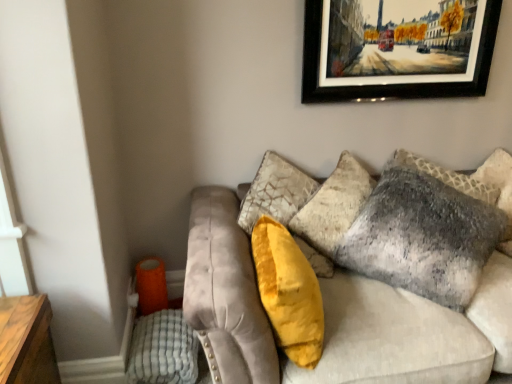
Describe the element at coordinates (397, 49) in the screenshot. Image resolution: width=512 pixels, height=384 pixels. I see `wooden-framed painting at upper center` at that location.

Find the location of a particular element. The width and height of the screenshot is (512, 384). velvet gray couch at center is located at coordinates (412, 332).

In terms of height, does textured gray pillow at upper right, which is the 3th pillow in left-to-right order, look taller or shorter compared to velvet gray couch at center?

Clearly, textured gray pillow at upper right, which is the 3th pillow in left-to-right order, is taller compared to velvet gray couch at center.

Considering the sizes of textured gray pillow at upper right, the first pillow positioned from the right, and velvet gray couch at center in the image, is textured gray pillow at upper right, the first pillow positioned from the right, bigger or smaller than velvet gray couch at center?

In the image, textured gray pillow at upper right, the first pillow positioned from the right, appears to be smaller than velvet gray couch at center.

Is textured gray pillow at upper right, which is the 3th pillow in left-to-right order, situated inside velvet gray couch at center or outside?

textured gray pillow at upper right, which is the 3th pillow in left-to-right order, is contained in velvet gray couch at center.

Is point (509, 155) farther from camera compared to point (297, 197)?

Yes.

Between textured gray pillow at upper right, marked as the second pillow in a right-to-left arrangement, and yellow fabric pillow at center, placed as the 1th pillow when sorted from left to right, which one has less height?

Standing shorter between the two is yellow fabric pillow at center, placed as the 1th pillow when sorted from left to right.

Measure the distance between textured gray pillow at upper right, marked as the second pillow in a right-to-left arrangement, and yellow fabric pillow at center, placed as the 1th pillow when sorted from left to right.

textured gray pillow at upper right, marked as the second pillow in a right-to-left arrangement, and yellow fabric pillow at center, placed as the 1th pillow when sorted from left to right, are 22.61 inches apart.

Would you say textured gray pillow at upper right, marked as the second pillow in a right-to-left arrangement, is a long distance from yellow fabric pillow at center, which is the third pillow in right-to-left order?

That's not correct — textured gray pillow at upper right, marked as the second pillow in a right-to-left arrangement, is a little close to yellow fabric pillow at center, which is the third pillow in right-to-left order.

From the image's perspective, is textured gray pillow at upper right, which ranks as the second pillow in left-to-right order, located beneath yellow fabric pillow at center, which is the third pillow in right-to-left order?

Actually, textured gray pillow at upper right, which ranks as the second pillow in left-to-right order, appears above yellow fabric pillow at center, which is the third pillow in right-to-left order, in the image.

How different are the orientations of velvet gray couch at center and yellow fabric pillow at center, placed as the 1th pillow when sorted from left to right, in degrees?

They differ by 85.3 degrees in their facing directions.

From the image's perspective, is velvet gray couch at center located above or below yellow fabric pillow at center, placed as the 1th pillow when sorted from left to right?

Based on their image positions, velvet gray couch at center is located beneath yellow fabric pillow at center, placed as the 1th pillow when sorted from left to right.

The width and height of the screenshot is (512, 384). Find the location of `studio couch located below the yellow fabric pillow at center, placed as the 1th pillow when sorted from left to right (from the image's perspective)`. studio couch located below the yellow fabric pillow at center, placed as the 1th pillow when sorted from left to right (from the image's perspective) is located at coordinates (412, 332).

Would you say velvet gray couch at center is inside or outside yellow fabric pillow at center, placed as the 1th pillow when sorted from left to right?

velvet gray couch at center exists outside the volume of yellow fabric pillow at center, placed as the 1th pillow when sorted from left to right.

From a real-world perspective, who is located lower, velvet gray couch at center or wooden-framed painting at upper center?

velvet gray couch at center, from a real-world perspective.

Is velvet gray couch at center to the right of wooden-framed painting at upper center from the viewer's perspective?

Indeed, velvet gray couch at center is positioned on the right side of wooden-framed painting at upper center.

Can you confirm if velvet gray couch at center is thinner than wooden-framed painting at upper center?

Incorrect, the width of velvet gray couch at center is not less than that of wooden-framed painting at upper center.

Is velvet gray couch at center oriented away from wooden-framed painting at upper center?

velvet gray couch at center does not have its back to wooden-framed painting at upper center.

Considering the sizes of objects textured gray pillow at upper right, which ranks as the second pillow in left-to-right order, and wooden-framed painting at upper center in the image provided, who is thinner, textured gray pillow at upper right, which ranks as the second pillow in left-to-right order, or wooden-framed painting at upper center?

wooden-framed painting at upper center is thinner.

From the image's perspective, which is below, textured gray pillow at upper right, marked as the second pillow in a right-to-left arrangement, or wooden-framed painting at upper center?

textured gray pillow at upper right, marked as the second pillow in a right-to-left arrangement, appears lower in the image.

Looking at this image, what's the angular difference between textured gray pillow at upper right, marked as the second pillow in a right-to-left arrangement, and wooden-framed painting at upper center's facing directions?

There is a 36.3-degree angle between the facing directions of textured gray pillow at upper right, marked as the second pillow in a right-to-left arrangement, and wooden-framed painting at upper center.

Does textured gray pillow at upper right, which ranks as the second pillow in left-to-right order, have a greater height compared to wooden-framed painting at upper center?

Indeed, textured gray pillow at upper right, which ranks as the second pillow in left-to-right order, has a greater height compared to wooden-framed painting at upper center.

Choose the correct answer: Is velvet gray couch at center inside textured gray pillow at upper right, the first pillow positioned from the right, or outside it?

velvet gray couch at center is not enclosed by textured gray pillow at upper right, the first pillow positioned from the right.

Between point (220, 208) and point (461, 184), which one is positioned in front?

The point (220, 208) is closer.

Is velvet gray couch at center further to camera compared to textured gray pillow at upper right, which is the 3th pillow in left-to-right order?

No.

From a real-world perspective, is velvet gray couch at center above or below textured gray pillow at upper right, the first pillow positioned from the right?

velvet gray couch at center is below textured gray pillow at upper right, the first pillow positioned from the right.

Which object is positioned more to the right, wooden-framed painting at upper center or textured gray pillow at upper right, which ranks as the second pillow in left-to-right order?

textured gray pillow at upper right, which ranks as the second pillow in left-to-right order.

Looking at this image, considering the sizes of wooden-framed painting at upper center and textured gray pillow at upper right, marked as the second pillow in a right-to-left arrangement, in the image, is wooden-framed painting at upper center bigger or smaller than textured gray pillow at upper right, marked as the second pillow in a right-to-left arrangement,?

Clearly, wooden-framed painting at upper center is smaller in size than textured gray pillow at upper right, marked as the second pillow in a right-to-left arrangement.

From a real-world perspective, is wooden-framed painting at upper center under textured gray pillow at upper right, marked as the second pillow in a right-to-left arrangement?

Actually, wooden-framed painting at upper center is physically above textured gray pillow at upper right, marked as the second pillow in a right-to-left arrangement, in the real world.

Where is `studio couch on the left of textured gray pillow at upper right, which is the 3th pillow in left-to-right order`? studio couch on the left of textured gray pillow at upper right, which is the 3th pillow in left-to-right order is located at coordinates (412, 332).

This screenshot has width=512, height=384. In the image, there is a textured gray pillow at upper right, which ranks as the second pillow in left-to-right order. What are the coordinates of `pillow below it (from the image's perspective)` in the screenshot? It's located at (288, 292).

Based on their spatial positions, is textured gray pillow at upper right, which is the 3th pillow in left-to-right order, or velvet gray couch at center further from yellow fabric pillow at center, which is the third pillow in right-to-left order?

textured gray pillow at upper right, which is the 3th pillow in left-to-right order, is positioned further to the anchor yellow fabric pillow at center, which is the third pillow in right-to-left order.

Considering their positions, is textured gray pillow at upper right, marked as the second pillow in a right-to-left arrangement, positioned closer to textured gray pillow at upper right, the first pillow positioned from the right, than velvet gray couch at center?

textured gray pillow at upper right, marked as the second pillow in a right-to-left arrangement, is positioned closer to the anchor textured gray pillow at upper right, the first pillow positioned from the right.

In the scene shown: From the image, which object appears to be nearer to yellow fabric pillow at center, which is the third pillow in right-to-left order, wooden-framed painting at upper center or textured gray pillow at upper right, which is the 3th pillow in left-to-right order?

wooden-framed painting at upper center lies closer to yellow fabric pillow at center, which is the third pillow in right-to-left order, than the other object.

From the picture: Estimate the real-world distances between objects in this image. Which object is further from yellow fabric pillow at center, which is the third pillow in right-to-left order, wooden-framed painting at upper center or textured gray pillow at upper right, marked as the second pillow in a right-to-left arrangement?

Among the two, wooden-framed painting at upper center is located further to yellow fabric pillow at center, which is the third pillow in right-to-left order.

When comparing their distances from textured gray pillow at upper right, the first pillow positioned from the right, does velvet gray couch at center or textured gray pillow at upper right, which ranks as the second pillow in left-to-right order, seem further?

velvet gray couch at center is positioned further to the anchor textured gray pillow at upper right, the first pillow positioned from the right.

Which object lies further to the anchor point velvet gray couch at center, textured gray pillow at upper right, which ranks as the second pillow in left-to-right order, or textured gray pillow at upper right, the first pillow positioned from the right?

textured gray pillow at upper right, the first pillow positioned from the right, is positioned further to the anchor velvet gray couch at center.

Looking at the image, which one is located further to velvet gray couch at center, textured gray pillow at upper right, marked as the second pillow in a right-to-left arrangement, or wooden-framed painting at upper center?

wooden-framed painting at upper center is positioned further to the anchor velvet gray couch at center.

Considering their positions, is textured gray pillow at upper right, which is the 3th pillow in left-to-right order, positioned further to textured gray pillow at upper right, marked as the second pillow in a right-to-left arrangement, than velvet gray couch at center?

velvet gray couch at center lies further to textured gray pillow at upper right, marked as the second pillow in a right-to-left arrangement, than the other object.

The width and height of the screenshot is (512, 384). In order to click on picture frame between yellow fabric pillow at center, placed as the 1th pillow when sorted from left to right, and textured gray pillow at upper right, the first pillow positioned from the right in this screenshot , I will do `click(397, 49)`.

The image size is (512, 384). What are the coordinates of `studio couch located between yellow fabric pillow at center, which is the third pillow in right-to-left order, and textured gray pillow at upper right, which ranks as the second pillow in left-to-right order, in the left-right direction` in the screenshot? It's located at (412, 332).

Identify the location of studio couch situated between yellow fabric pillow at center, placed as the 1th pillow when sorted from left to right, and textured gray pillow at upper right, which is the 3th pillow in left-to-right order, from left to right. (412, 332).

This screenshot has height=384, width=512. Identify the location of pillow situated between yellow fabric pillow at center, placed as the 1th pillow when sorted from left to right, and textured gray pillow at upper right, the first pillow positioned from the right, from left to right. (426, 231).